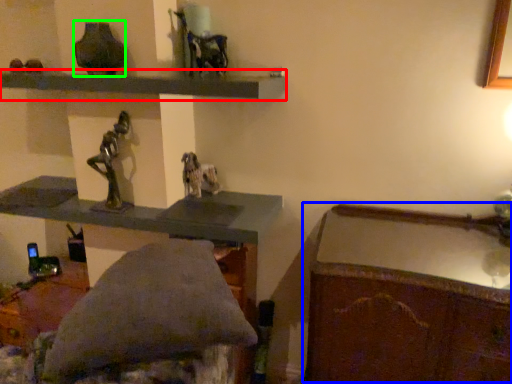
Question: Considering the real-world distances, which object is closest to shelf (highlighted by a red box)? writing desk (highlighted by a blue box) or vase (highlighted by a green box).

Choices:
 (A) writing desk
 (B) vase

Answer: (B)